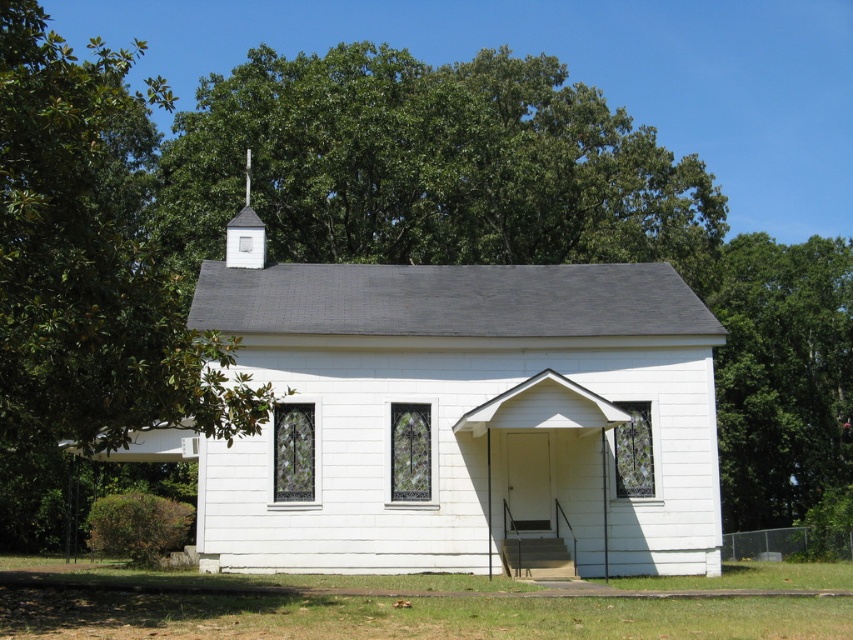
You are standing in front of the church and want to locate the point at coordinates point (461, 417). Based on the scene description, where exactly on the white wood chapel at center would this point be located?

The point (461, 417) is on the white wood chapel at center, specifically on its walls constructed from white painted wooden planks.